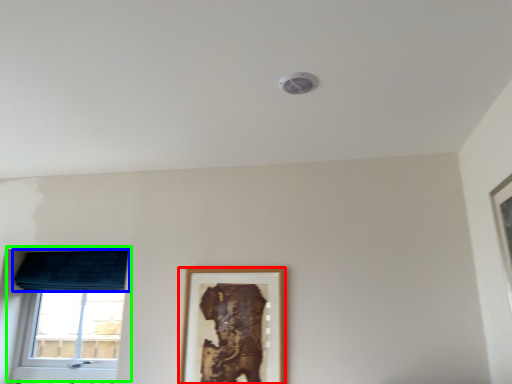
Question: Based on their relative distances, which object is farther from picture frame (highlighted by a red box)? Choose from curtain (highlighted by a blue box) and window (highlighted by a green box).

Choices:
 (A) curtain
 (B) window

Answer: (B)